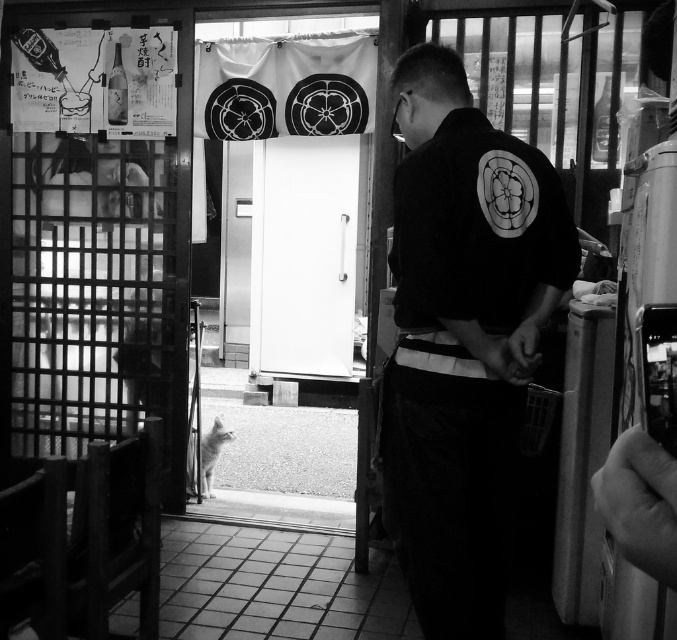
Does black cotton shirt at center appear on the left side of white smooth door at center?

No, black cotton shirt at center is not to the left of white smooth door at center.

What do you see at coordinates (462, 337) in the screenshot? This screenshot has width=677, height=640. I see `black cotton shirt at center` at bounding box center [462, 337].

What do you see at coordinates (462, 337) in the screenshot?
I see `black cotton shirt at center` at bounding box center [462, 337].

The width and height of the screenshot is (677, 640). Find the location of `black cotton shirt at center`. black cotton shirt at center is located at coordinates (462, 337).